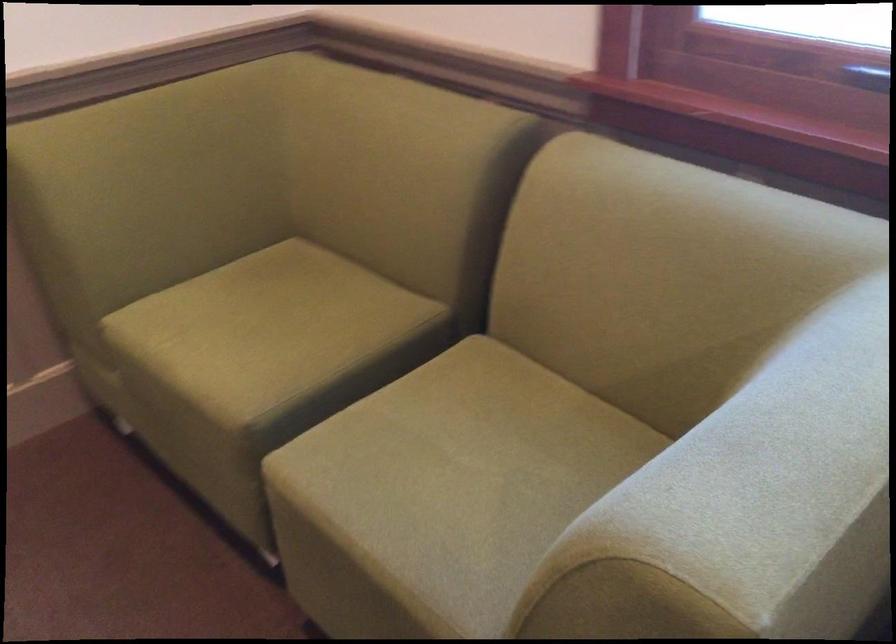
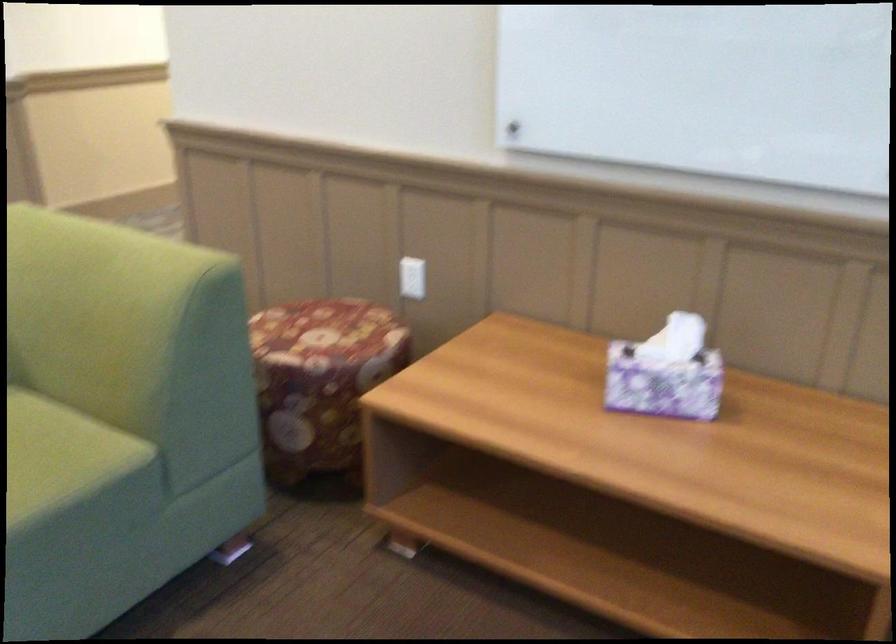
How did the camera likely rotate?

The rotation direction of the camera is left-down.